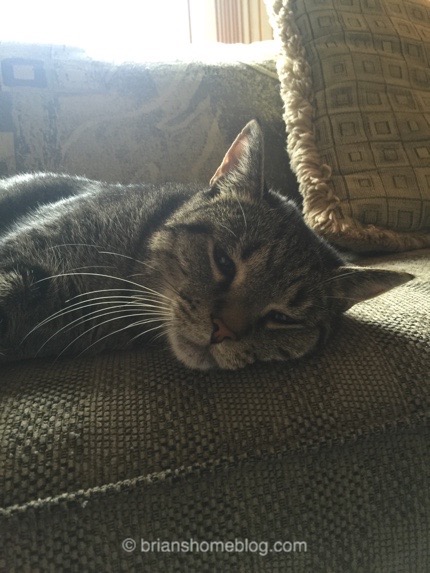
Where is `window`? window is located at coordinates (118, 19).